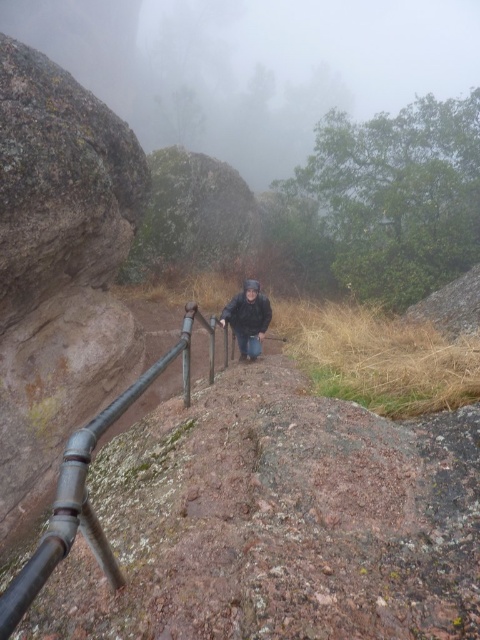
Consider the image. Who is more forward, (12,589) or (259,289)?

Point (12,589)

Image resolution: width=480 pixels, height=640 pixels. What do you see at coordinates (85, 486) in the screenshot?
I see `metallic pipe at center` at bounding box center [85, 486].

Measure the distance between metallic pipe at center and camera.

metallic pipe at center and camera are 3.30 meters apart.

The height and width of the screenshot is (640, 480). In order to click on metallic pipe at center in this screenshot , I will do `click(85, 486)`.